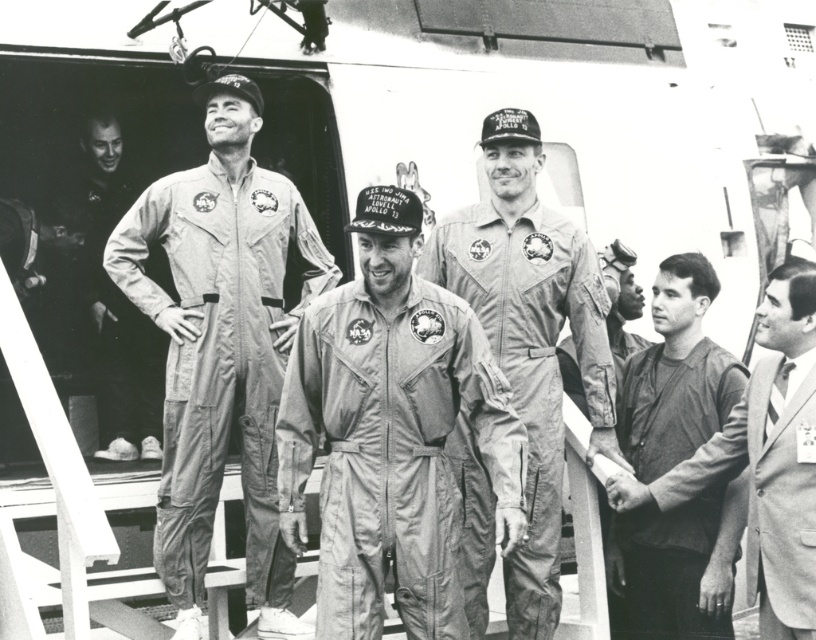
Question: Is light gray jumpsuit at center bigger than light gray fabric jumpsuit at center?

Choices:
 (A) no
 (B) yes

Answer: (B)

Question: Is matte gray jumpsuit at center wider than dark gray suit at center?

Choices:
 (A) no
 (B) yes

Answer: (B)

Question: Is matte gray jumpsuit at center bigger than dark gray suit at center?

Choices:
 (A) yes
 (B) no

Answer: (B)

Question: Which point appears closest to the camera in this image?

Choices:
 (A) (153, 368)
 (B) (183, 577)

Answer: (B)

Question: Among these points, which one is farthest from the camera?

Choices:
 (A) (543, 573)
 (B) (792, 300)
 (C) (455, 538)

Answer: (B)

Question: Which is nearer to the matte gray jumpsuit at center?

Choices:
 (A) dark gray suit at center
 (B) matte white jumpsuit at left
 (C) light gray jumpsuit at center
 (D) light gray fabric jumpsuit at center

Answer: (D)